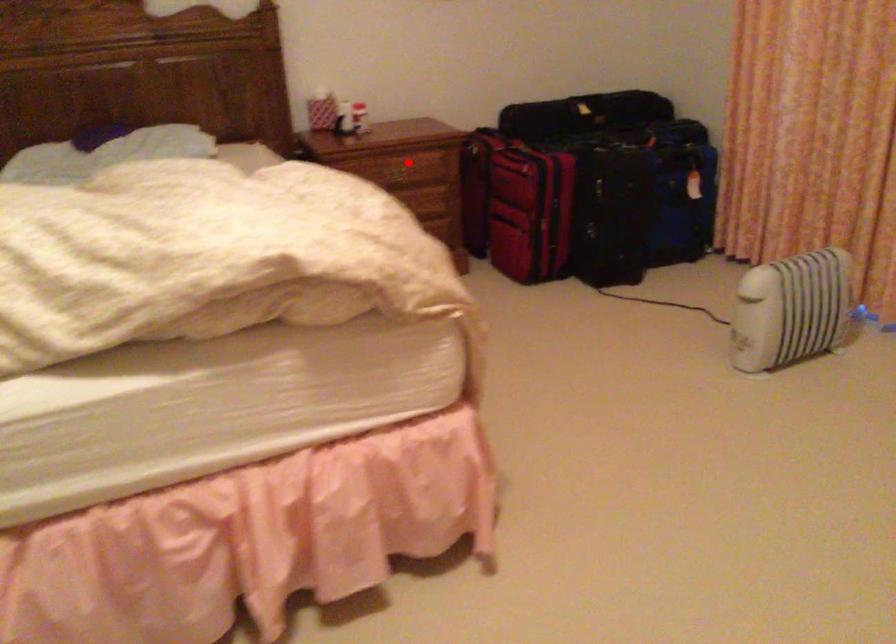
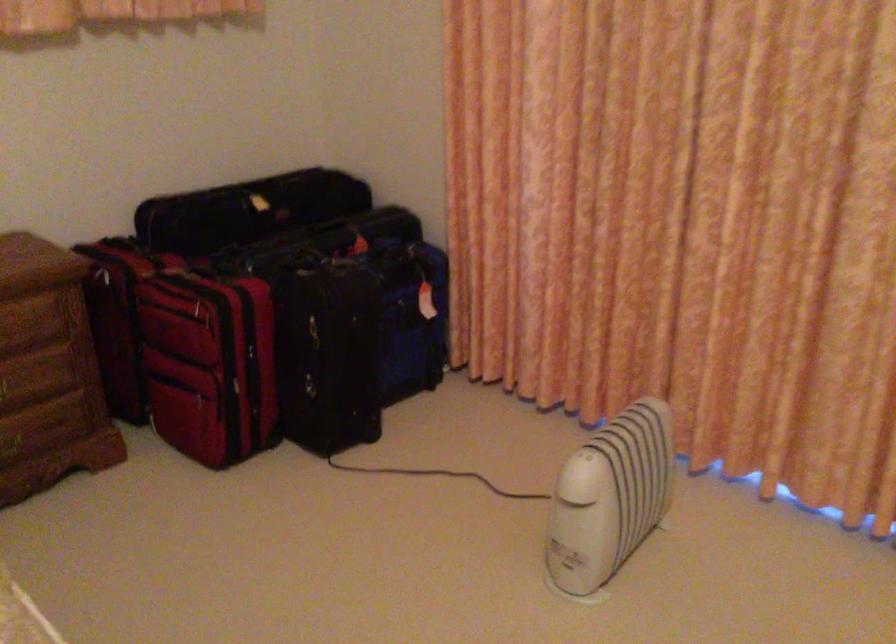
Locate, in the second image, the point that corresponds to the highlighted location in the first image.

(14, 319)